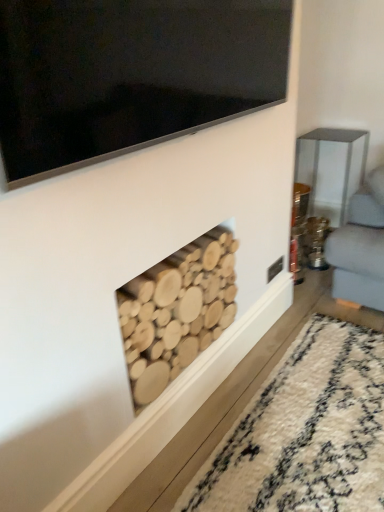
Question: Does black glossy tv at upper center have a smaller size compared to natural wood logs at center?

Choices:
 (A) no
 (B) yes

Answer: (B)

Question: Is natural wood logs at center at the back of black glossy tv at upper center?

Choices:
 (A) no
 (B) yes

Answer: (A)

Question: Is black glossy tv at upper center positioned beyond the bounds of natural wood logs at center?

Choices:
 (A) yes
 (B) no

Answer: (A)

Question: From the image's perspective, would you say black glossy tv at upper center is shown under natural wood logs at center?

Choices:
 (A) no
 (B) yes

Answer: (A)

Question: Is black glossy tv at upper center in front of natural wood logs at center?

Choices:
 (A) no
 (B) yes

Answer: (B)

Question: Could you tell me if black glossy tv at upper center is facing natural wood logs at center?

Choices:
 (A) yes
 (B) no

Answer: (B)

Question: Considering the relative sizes of natural wood logs at center and black glossy tv at upper center in the image provided, is natural wood logs at center shorter than black glossy tv at upper center?

Choices:
 (A) yes
 (B) no

Answer: (B)

Question: Considering the relative sizes of natural wood logs at center and black glossy tv at upper center in the image provided, is natural wood logs at center bigger than black glossy tv at upper center?

Choices:
 (A) no
 (B) yes

Answer: (B)

Question: Is natural wood logs at center placed right next to black glossy tv at upper center?

Choices:
 (A) yes
 (B) no

Answer: (B)

Question: Is natural wood logs at center not near black glossy tv at upper center?

Choices:
 (A) yes
 (B) no

Answer: (B)

Question: Is natural wood logs at center thinner than black glossy tv at upper center?

Choices:
 (A) no
 (B) yes

Answer: (A)

Question: Can you confirm if natural wood logs at center is wider than black glossy tv at upper center?

Choices:
 (A) no
 (B) yes

Answer: (B)

Question: Considering the positions of natural wood logs at center and black glossy tv at upper center in the image, is natural wood logs at center taller or shorter than black glossy tv at upper center?

Choices:
 (A) short
 (B) tall

Answer: (B)